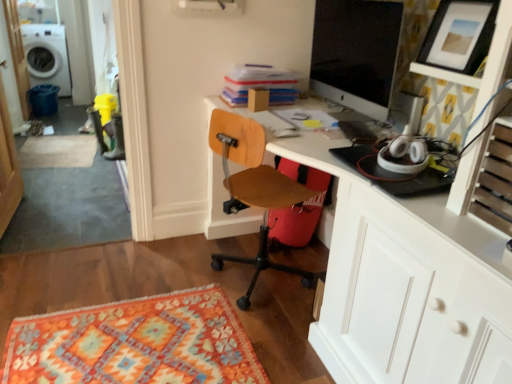
Question: From their relative heights in the image, would you say beige carpet at lower left, positioned as the 1th mat in top-to-bottom order, is taller or shorter than white glossy washing machine at upper left?

Choices:
 (A) short
 (B) tall

Answer: (A)

Question: From the image's perspective, is beige carpet at lower left, which ranks as the first mat in back-to-front order, above or below white glossy washing machine at upper left?

Choices:
 (A) below
 (B) above

Answer: (A)

Question: Based on their relative distances, which object is nearer to the transparent glass door at upper left, positioned as the 1th glass door in top-to-bottom order?

Choices:
 (A) white glossy washing machine at upper left
 (B) matte black picture frame at upper right
 (C) wooden drawer at right
 (D) woodenchair at center
 (E) white glossy desk at upper center

Answer: (A)

Question: Which object is the farthest from the white glossy washing machine at upper left?

Choices:
 (A) white glossy desk at upper center
 (B) wooden drawer at right
 (C) beige carpet at lower left, acting as the second mat starting from the right
 (D) transparent glass door at left, which is the 2th glass door from back to front
 (E) transparent glass door at upper left, acting as the second glass door starting from the bottom

Answer: (B)